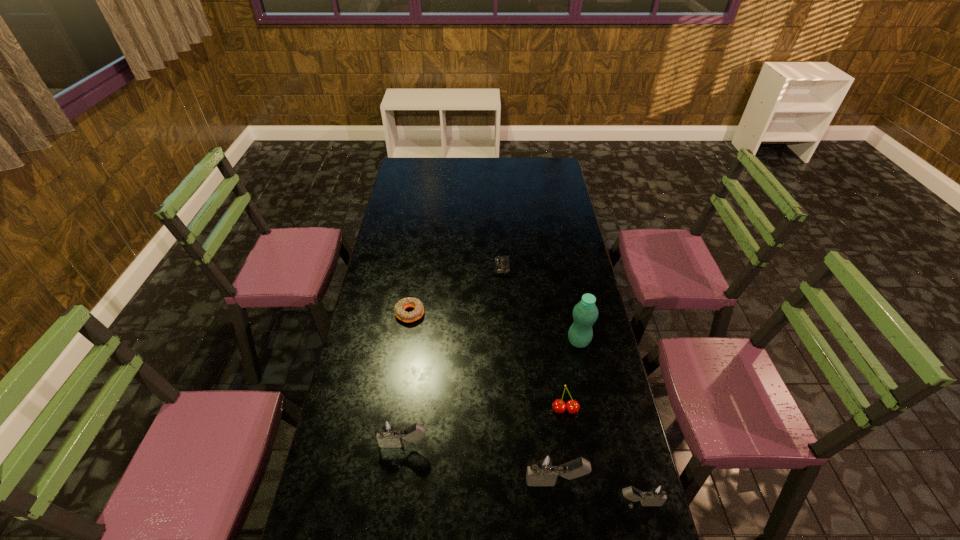
At what (x,y) coordinates should I click in order to perform the action: click on free area in between the second shortest object and the cherry. Please return your answer as a coordinate pair (x, y). Looking at the image, I should click on (488, 362).

You are a GUI agent. You are given a task and a screenshot of the screen. Output one action in this format:
    pyautogui.click(x=<x>, y=<y>)
    Task: Click on the empty location between the cherry and the shortest igniter
    The height and width of the screenshot is (540, 960).
    Given the screenshot: What is the action you would take?
    pyautogui.click(x=602, y=456)

I want to click on free area in between the fourth nearest object and the fifth shortest object, so click(x=485, y=427).

Locate an element on the screen. The height and width of the screenshot is (540, 960). object that ranks as the sixth closest to the shortest object is located at coordinates (656, 494).

Identify which object is located as the second nearest to the alarm clock. Please provide its 2D coordinates. Your answer should be formatted as a tuple, i.e. [(x, y)], where the tuple contains the x and y coordinates of a point satisfying the conditions above.

[(585, 313)]

You are a GUI agent. You are given a task and a screenshot of the screen. Output one action in this format:
    pyautogui.click(x=<x>, y=<y>)
    Task: Click on the igniter identified as the closest to the shortest igniter
    
    Given the screenshot: What is the action you would take?
    pyautogui.click(x=543, y=470)

Select which igniter appears as the second closest to the shortest igniter. Please provide its 2D coordinates. Your answer should be formatted as a tuple, i.e. [(x, y)], where the tuple contains the x and y coordinates of a point satisfying the conditions above.

[(389, 435)]

Where is `vacant space that satisfies the following two spatial constraints: 1. on the front side of the rightmost igniter; 2. on the left side of the second igniter from left to right`? Image resolution: width=960 pixels, height=540 pixels. vacant space that satisfies the following two spatial constraints: 1. on the front side of the rightmost igniter; 2. on the left side of the second igniter from left to right is located at coordinates (558, 503).

The width and height of the screenshot is (960, 540). I want to click on vacant space that satisfies the following two spatial constraints: 1. on the display of the alarm clock; 2. on the back side of the rightmost igniter, so click(514, 503).

The image size is (960, 540). What are the coordinates of `free space that satisfies the following two spatial constraints: 1. at the front cap of the third farthest object; 2. on the left side of the rightmost igniter` in the screenshot? It's located at (612, 503).